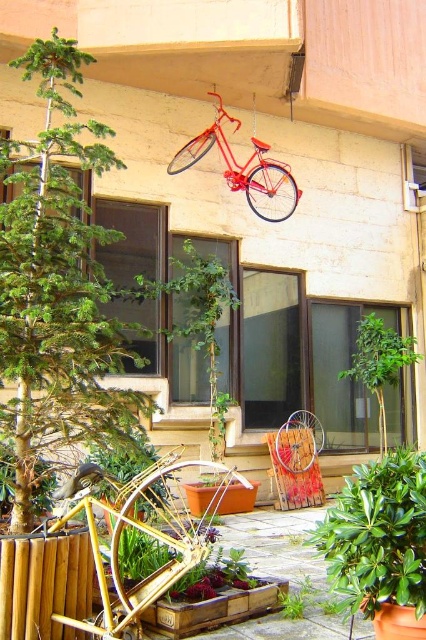
Question: Where is green matte tree at left located in relation to green glossy plant at lower right in the image?

Choices:
 (A) above
 (B) below

Answer: (A)

Question: Which point is farther to the camera?

Choices:
 (A) (203, 148)
 (B) (58, 260)
 (C) (115, 492)

Answer: (A)

Question: Can you confirm if green glossy plant at lower right is positioned above shiny red bicycle at upper center?

Choices:
 (A) yes
 (B) no

Answer: (B)

Question: Which of these objects is positioned closest to the green matte tree at left?

Choices:
 (A) gold metallic bicycle at lower left
 (B) green leafy tree at center

Answer: (A)

Question: Is green matte tree at left wider than gold metallic bicycle at lower left?

Choices:
 (A) no
 (B) yes

Answer: (B)

Question: Which point is farther from the camera taking this photo?

Choices:
 (A) (362, 353)
 (B) (129, 592)
 (C) (5, 241)
 (D) (264, 152)

Answer: (D)